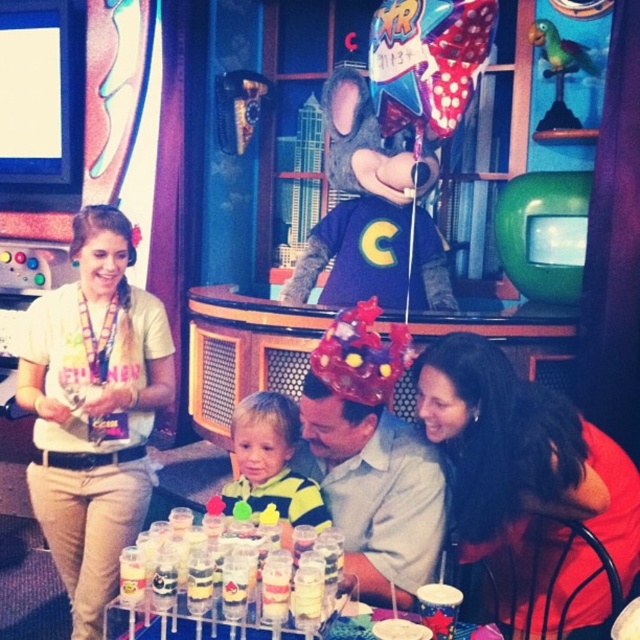
Is point (524, 236) farther from viewer compared to point (166, 630)?

Yes, point (524, 236) is behind point (166, 630).

Is point (573, 198) positioned behind point (200, 627)?

Yes, point (573, 198) is farther from viewer.

Locate an element on the screen. Image resolution: width=640 pixels, height=640 pixels. green rubber balloon at upper center is located at coordinates (544, 234).

Does white cotton shirt at left have a lesser width compared to striped fabric shirt at center?

No.

Between point (65, 570) and point (234, 412), which one is positioned behind?

Point (65, 570)

Identify the location of white cotton shirt at left. The width and height of the screenshot is (640, 640). (93, 410).

Who is positioned more to the right, green rubber balloon at upper center or striped fabric shirt at center?

green rubber balloon at upper center

Between point (560, 182) and point (264, 492), which one is positioned in front?

Point (264, 492)

Where is `green rubber balloon at upper center`? This screenshot has width=640, height=640. green rubber balloon at upper center is located at coordinates pyautogui.click(x=544, y=234).

This screenshot has width=640, height=640. I want to click on green rubber balloon at upper center, so click(544, 234).